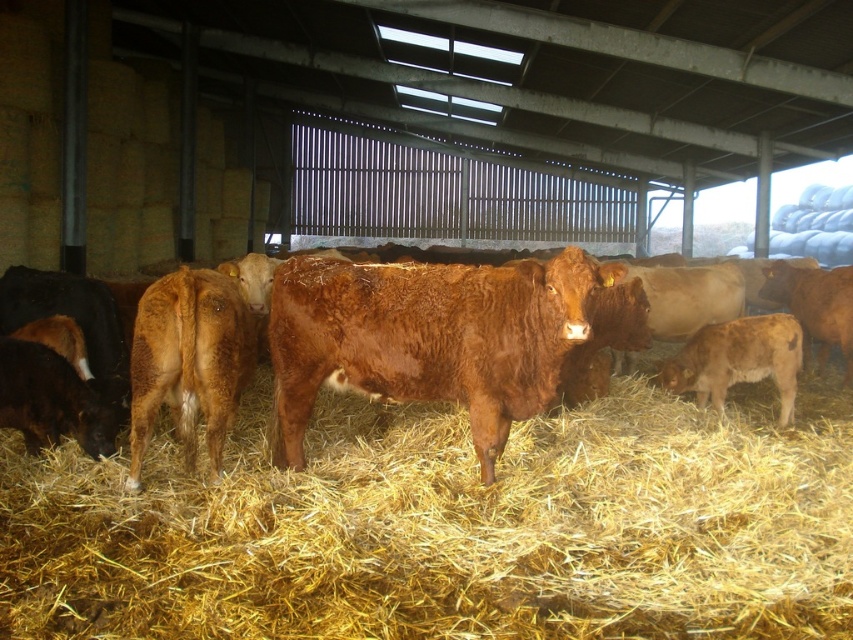
Question: Can you confirm if yellow straw at center is positioned to the left of brown furry cow at center?

Choices:
 (A) yes
 (B) no

Answer: (B)

Question: Which object is the closest to the brown furry cow at center?

Choices:
 (A) brown furry calf at lower right
 (B) yellow straw at center
 (C) brown furry bull at center

Answer: (C)

Question: Estimate the real-world distances between objects in this image. Which object is farther from the brown furry bull at center?

Choices:
 (A) brown furry calf at lower right
 (B) brown furry cow at center

Answer: (A)

Question: Which object is farther from the camera taking this photo?

Choices:
 (A) yellow straw at center
 (B) brown furry bull at center
 (C) brown furry calf at lower right

Answer: (C)

Question: Where is brown furry cow at center located in relation to brown furry calf at lower right in the image?

Choices:
 (A) above
 (B) below

Answer: (A)

Question: Does yellow straw at center appear on the left side of brown furry calf at lower right?

Choices:
 (A) yes
 (B) no

Answer: (A)